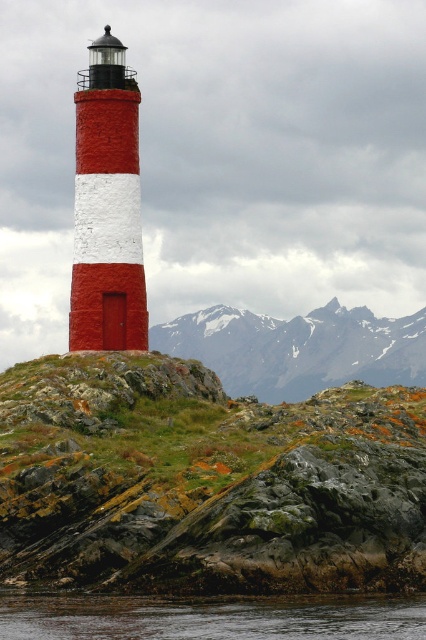
The width and height of the screenshot is (426, 640). Describe the element at coordinates (298, 348) in the screenshot. I see `snowy rocky mountain at upper center` at that location.

The height and width of the screenshot is (640, 426). In order to click on snowy rocky mountain at upper center in this screenshot , I will do `click(298, 348)`.

From the picture: Which is more to the left, green mossy rock at center or transparent water at lower center?

From the viewer's perspective, transparent water at lower center appears more on the left side.

Is green mossy rock at center above transparent water at lower center?

Yes, green mossy rock at center is above transparent water at lower center.

This screenshot has height=640, width=426. I want to click on green mossy rock at center, so click(x=204, y=481).

Who is lower down, green mossy rock at center or snowy rocky mountain at upper center?

green mossy rock at center is lower down.

Can you confirm if green mossy rock at center is thinner than snowy rocky mountain at upper center?

Yes.

This screenshot has width=426, height=640. Identify the location of green mossy rock at center. (204, 481).